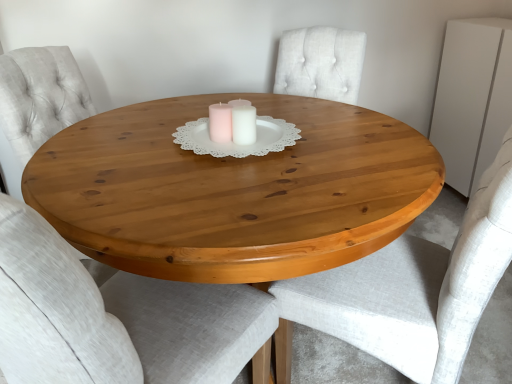
The image size is (512, 384). I want to click on vacant space to the right of white matte candle at center, so click(303, 135).